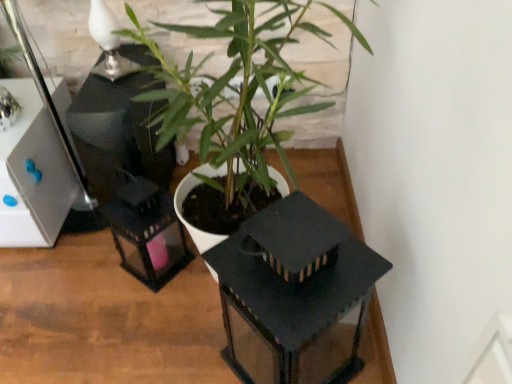
Locate an element on the screen. Image resolution: width=512 pixels, height=384 pixels. free space in front of white glossy table lamp at upper left is located at coordinates (105, 94).